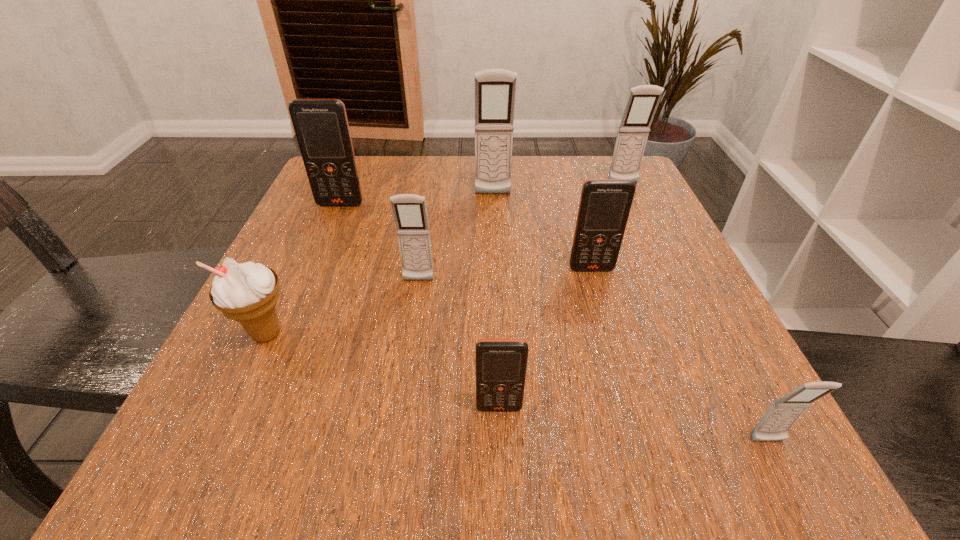
Where is `the third nearest object`? The image size is (960, 540). the third nearest object is located at coordinates (248, 293).

Identify the location of icecream. (248, 293).

Image resolution: width=960 pixels, height=540 pixels. In order to click on the seventh farthest object in this screenshot , I will do `click(501, 364)`.

The height and width of the screenshot is (540, 960). I want to click on the smallest orange cellular telephone, so click(501, 364).

Locate an element on the screen. the nearest cellular telephone is located at coordinates (774, 425).

Locate an element on the screen. This screenshot has width=960, height=540. the smallest gray cellular telephone is located at coordinates (774, 425).

At what (x,y) coordinates should I click in order to perform the action: click on free space located 0.380m on the front-facing side of the second gray cellular telephone from left to right. Please return your answer as a coordinate pair (x, y). Image resolution: width=960 pixels, height=540 pixels. Looking at the image, I should click on (498, 330).

This screenshot has width=960, height=540. Find the location of `vacant space located on the front-facing side of the farthest cellular telephone`. vacant space located on the front-facing side of the farthest cellular telephone is located at coordinates (638, 217).

You are a GUI agent. You are given a task and a screenshot of the screen. Output one action in this format:
    pyautogui.click(x=<x>, y=<y>)
    Task: Click on the vacant space positioned 0.330m on the screen of the farthest orange cellular telephone
    The width and height of the screenshot is (960, 540).
    Given the screenshot: What is the action you would take?
    pyautogui.click(x=290, y=323)

Find the location of a particular element. Image resolution: width=960 pixels, height=540 pixels. blank area located 0.140m on the front-facing side of the leftmost gray cellular telephone is located at coordinates 408,350.